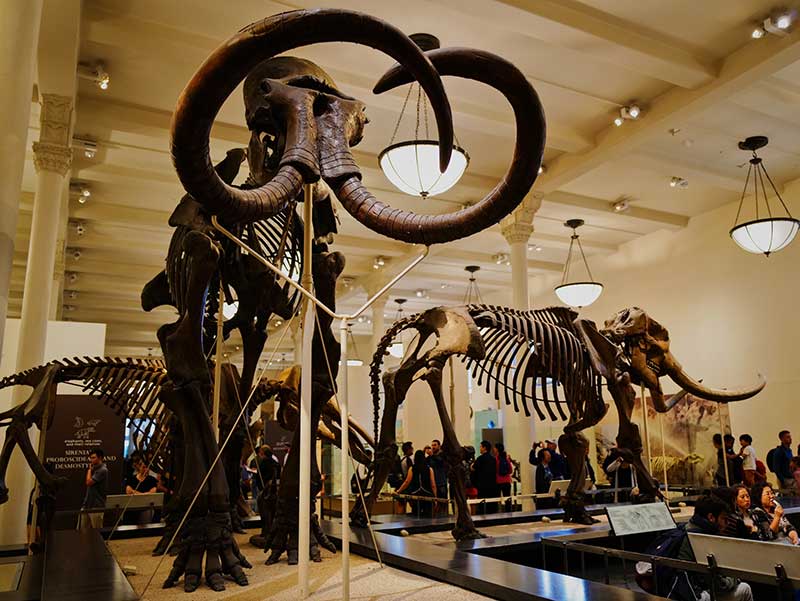
You are a GUI agent. You are given a task and a screenshot of the screen. Output one action in this format:
    pyautogui.click(x=<x>, y=<y>)
    Task: Click on the ceiling
    
    Given the screenshot: What is the action you would take?
    pyautogui.click(x=166, y=71)